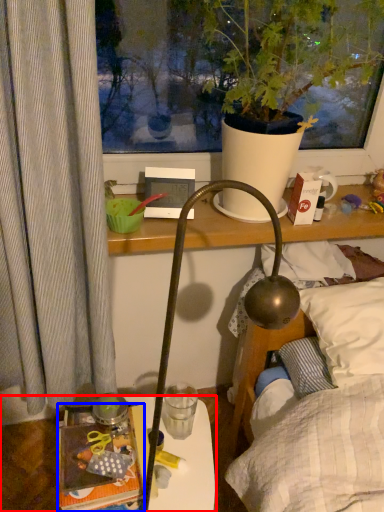
Question: Which object appears farthest to the camera in this image, table (highlighted by a red box) or book (highlighted by a blue box)?

Choices:
 (A) table
 (B) book

Answer: (A)